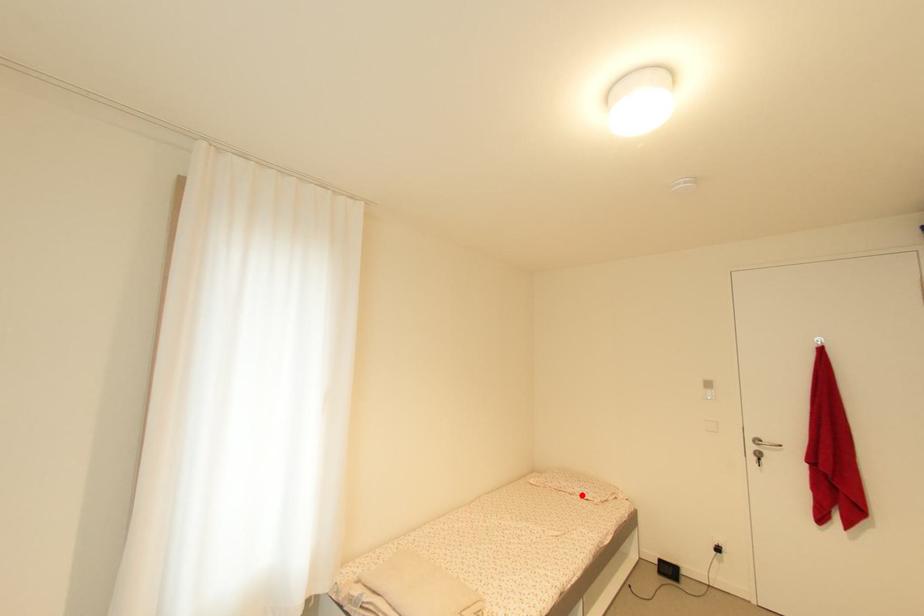
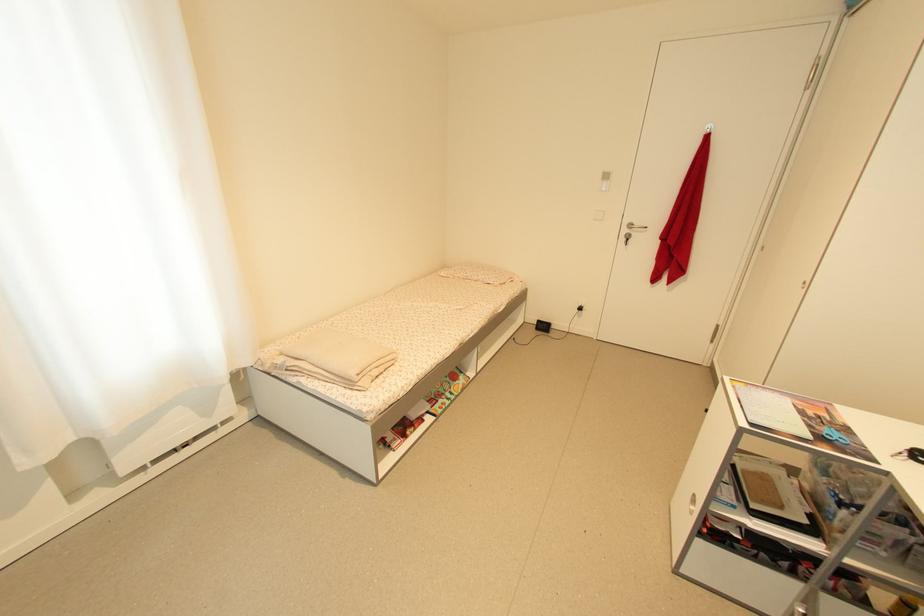
Question: I am providing you with two images of the same scene from different viewpoints. Given a red point in image1, look at the same physical point in image2. Is it:

Choices:
 (A) Closer to the viewpoint
 (B) Farther from the viewpoint

Answer: (A)